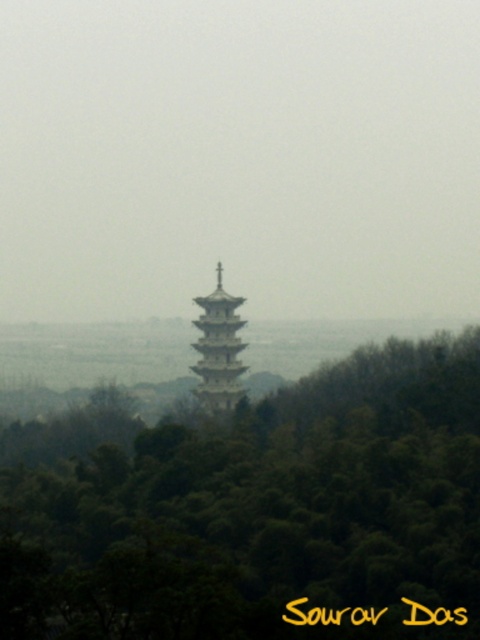
Question: Which point is closer to the camera?

Choices:
 (A) (168, 572)
 (B) (227, 308)

Answer: (B)

Question: Which point is farther to the camera?

Choices:
 (A) pyautogui.click(x=222, y=401)
 (B) pyautogui.click(x=129, y=490)

Answer: (B)

Question: Does green matte tree at center appear on the right side of white stone pagoda at center?

Choices:
 (A) no
 (B) yes

Answer: (B)

Question: From the image, what is the correct spatial relationship of green matte tree at center in relation to white stone pagoda at center?

Choices:
 (A) above
 (B) below

Answer: (B)

Question: Is green matte tree at center thinner than white stone pagoda at center?

Choices:
 (A) yes
 (B) no

Answer: (B)